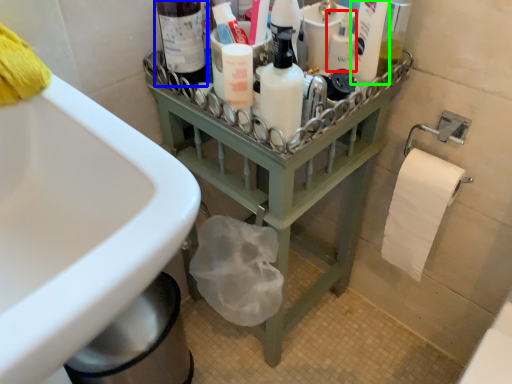
Question: Which object is the closest to the mouthwash (highlighted by a red box)? Choose among these: bottle (highlighted by a blue box) or cleaning product (highlighted by a green box).

Choices:
 (A) bottle
 (B) cleaning product

Answer: (B)